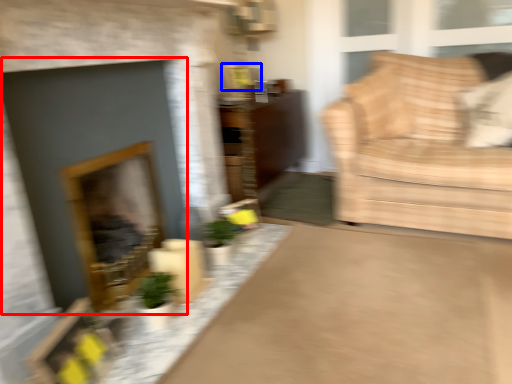
Question: Which object appears closest to the camera in this image, fireplace (highlighted by a red box) or picture frame (highlighted by a blue box)?

Choices:
 (A) fireplace
 (B) picture frame

Answer: (A)